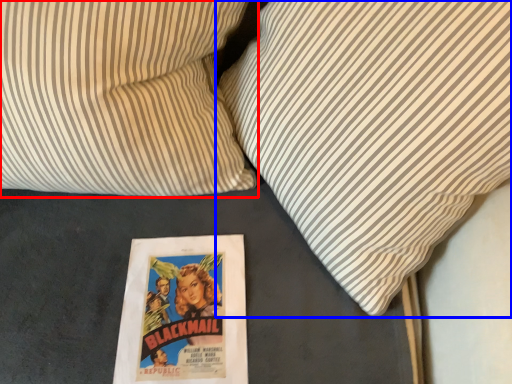
Question: Which of the following is the closest to the observer, pillow (highlighted by a red box) or pillow (highlighted by a blue box)?

Choices:
 (A) pillow
 (B) pillow

Answer: (B)